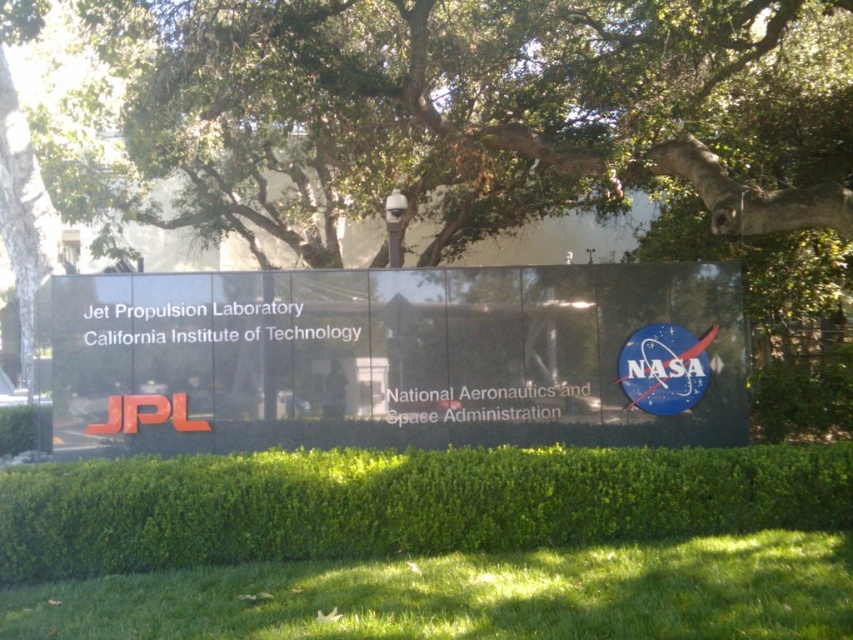
Which is behind, point (479, 481) or point (250, 605)?

Point (479, 481)

Which is more to the right, green leafy hedge at center or green grass at lower center?

green leafy hedge at center

Who is more forward, [573,456] or [498,563]?

Positioned in front is point [498,563].

Where is `green leafy hedge at center`? green leafy hedge at center is located at coordinates (399, 502).

Consider the image. Measure the distance from green leafy tree at upper center to green leafy hedge at center.

They are 6.85 meters apart.

Is green leafy tree at upper center wider than green leafy hedge at center?

Yes.

Is point (517, 96) closer to viewer compared to point (86, 477)?

No, (517, 96) is further to viewer.

The width and height of the screenshot is (853, 640). In order to click on green leafy tree at upper center in this screenshot , I will do click(508, 100).

Can you confirm if green leafy tree at upper center is shorter than green grass at lower center?

No.

Is green leafy tree at upper center bigger than green grass at lower center?

Correct, green leafy tree at upper center is larger in size than green grass at lower center.

Locate an element on the screen. The height and width of the screenshot is (640, 853). green leafy tree at upper center is located at coordinates (508, 100).

Where is `green leafy tree at upper center`? The width and height of the screenshot is (853, 640). green leafy tree at upper center is located at coordinates (508, 100).